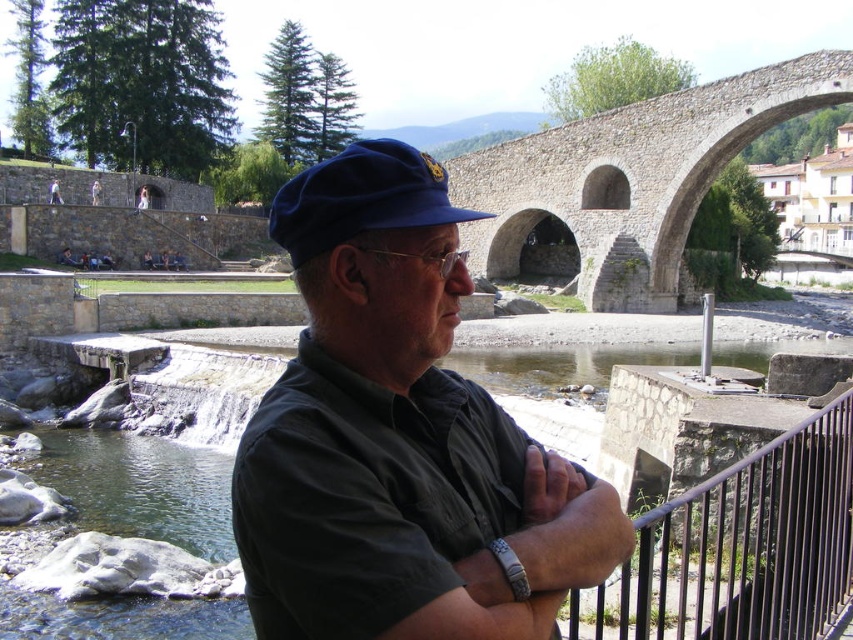
You are a photographer trying to capture a candid shot of the man in the dark blue uniform at center without him noticing. Since the black metal railing at lower right is in the way, where should you position yourself to get a clear view?

The dark blue uniform at center is positioned over the black metal railing at lower right, so positioning yourself behind the railing would allow you to see the man without obstruction.

You are a photographer trying to capture the blue velvety cap at center and the black metal railing at lower right in the same frame. Which object should you position closer to the edge of your camera viewfinder to include both?

To include both the blue velvety cap at center and the black metal railing at lower right in the frame, position the black metal railing at lower right closer to the edge since it is located to the right of the blue velvety cap at center.

You are a photographer trying to capture a photo of the dark blue uniform at center and the black metal railing at lower right. Since you want both objects to appear equally prominent in the photo, which object should you zoom in more on?

The dark blue uniform at center is larger in size than the black metal railing at lower right, so you should zoom in more on the black metal railing at lower right to make them appear equally prominent in the photo.